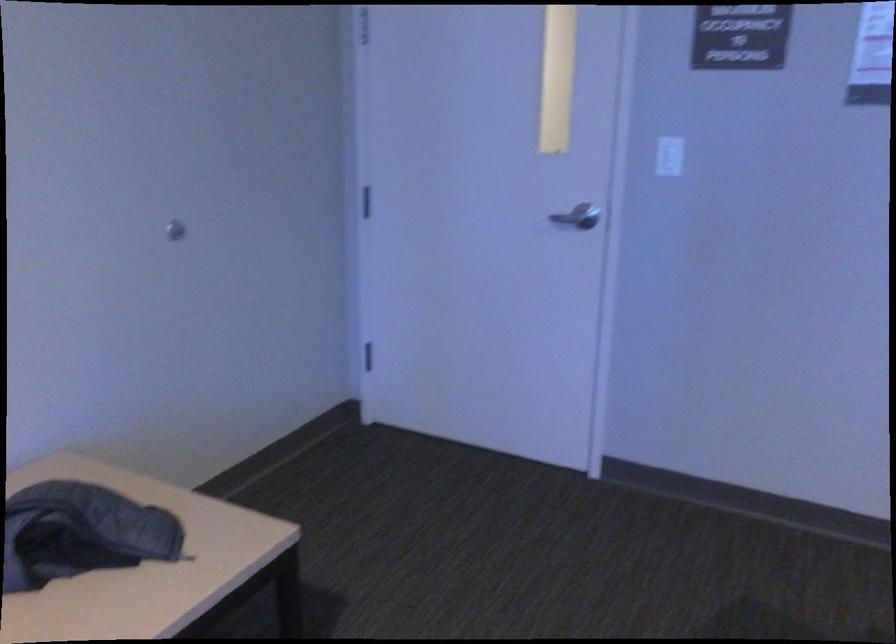
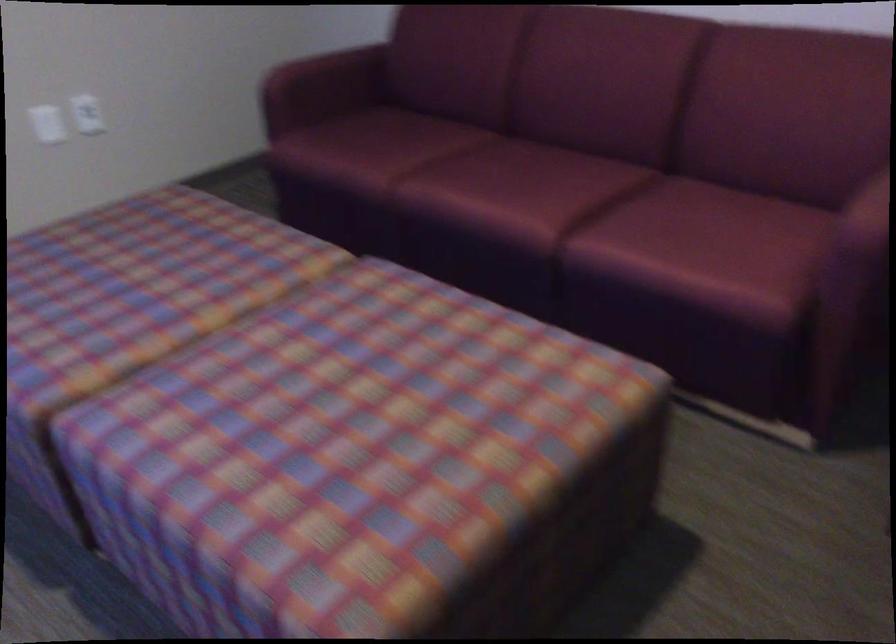
First-person continuous shooting, in which direction is the camera rotating?

The camera rotated toward left-down.